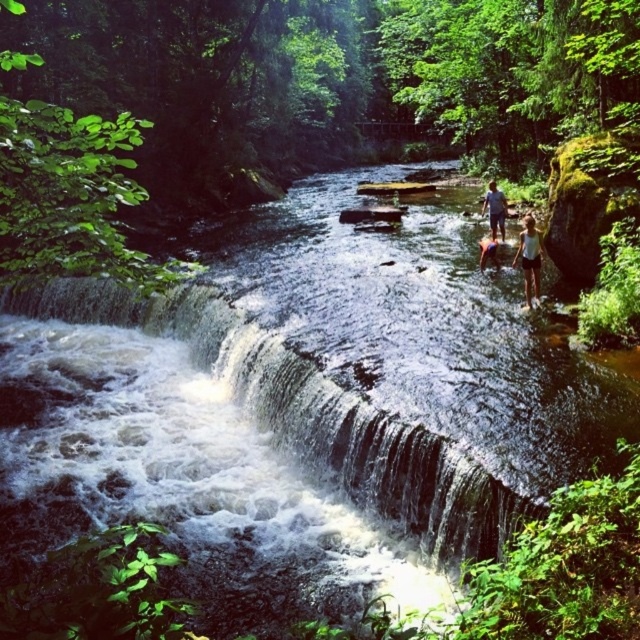
You are standing at the edge of the river in the scene and want to walk towards the waterfall. There are two points marked on the path ahead of you. The first point is at coordinate point[531,282] and the second is at point[483,205]. Which point should you aim for first to reach the waterfall more quickly?

Point[531,282] is in front of point[483,205], so you should aim for point[531,282] first to reach the waterfall more quickly.